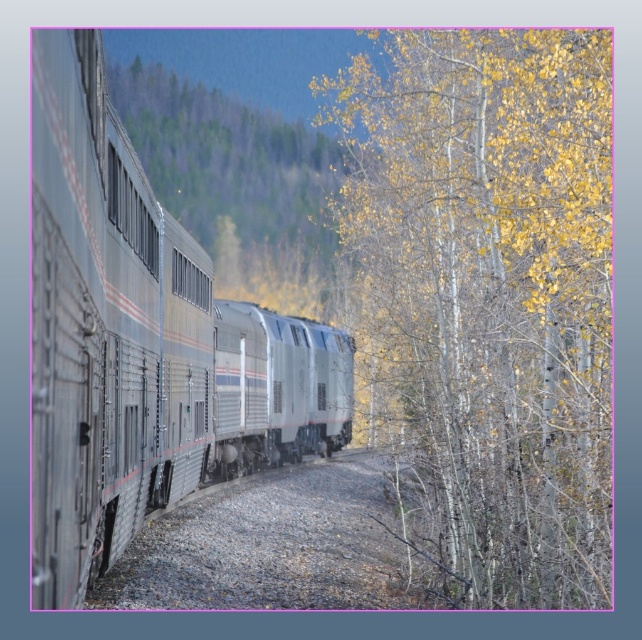
Question: Which of the following is the farthest from the observer?

Choices:
 (A) (114, 419)
 (B) (602, 435)

Answer: (A)

Question: Among these objects, which one is farthest from the camera?

Choices:
 (A) yellow leafy tree at right
 (B) satin silver train car at center

Answer: (B)

Question: Can you confirm if yellow leafy tree at right is thinner than silver metallic train at left?

Choices:
 (A) no
 (B) yes

Answer: (A)

Question: Observing the image, what is the correct spatial positioning of silver metallic train at left in reference to green matte train at left?

Choices:
 (A) above
 (B) below

Answer: (B)

Question: Which object is closer to the camera taking this photo?

Choices:
 (A) green matte train at left
 (B) satin silver train car at center
 (C) yellow leafy tree at right
 (D) silver metallic train at left

Answer: (D)

Question: Does silver metallic train at left appear on the left side of satin silver train car at center?

Choices:
 (A) yes
 (B) no

Answer: (A)